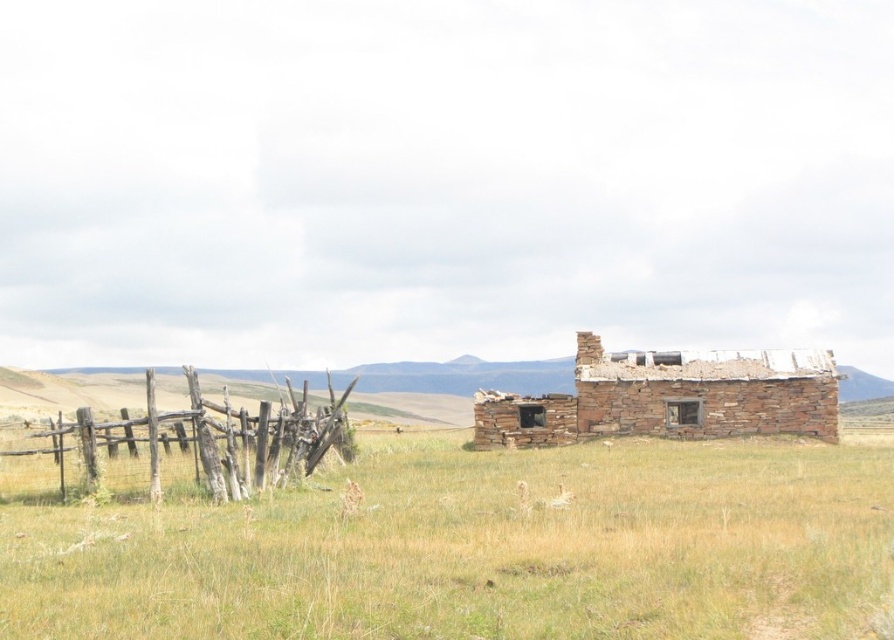
You are standing in the middle of the field looking towards the rustic stone hut at right and the weathered wood fence at left. Which object is closer to you?

The weathered wood fence at left is closer to you because the rustic stone hut at right is positioned over it, indicating it is further away.